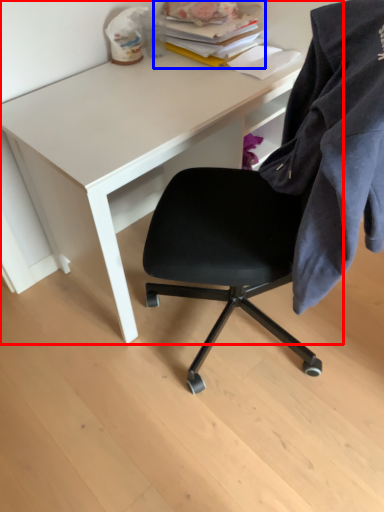
Question: Which point is closer to the camera, desk (highlighted by a red box) or book (highlighted by a blue box)?

Choices:
 (A) desk
 (B) book

Answer: (A)